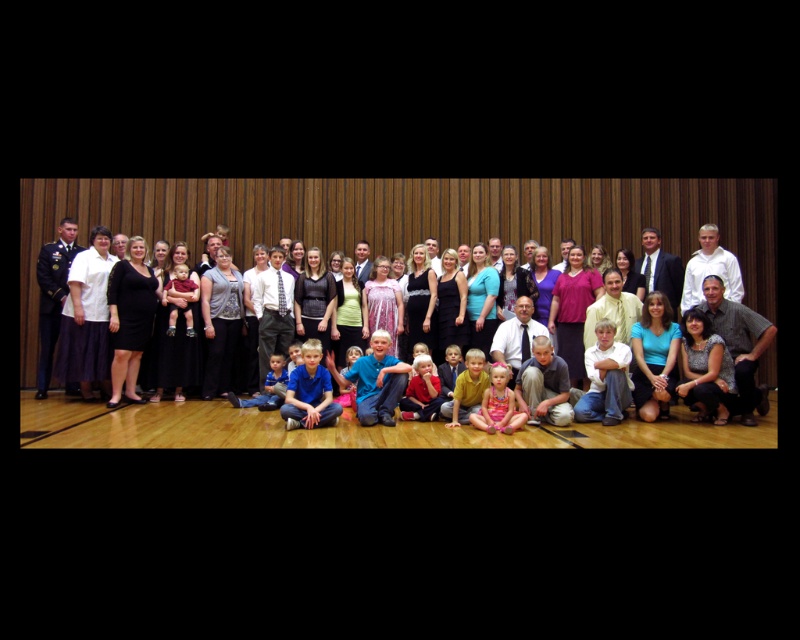
Between dark blue uniform at left and white shirt at center, which one has less height?

white shirt at center is shorter.

Between dark blue uniform at left and white shirt at center, which one appears on the right side from the viewer's perspective?

Positioned to the right is white shirt at center.

What are the coordinates of `dark blue uniform at left` in the screenshot? It's located at (52, 296).

Can you confirm if matte black dress at center is positioned below white shirt at center?

Yes, matte black dress at center is below white shirt at center.

Does matte black dress at center have a greater width compared to white shirt at center?

Yes.

The width and height of the screenshot is (800, 640). Identify the location of matte black dress at center. (62, 420).

Is dark blue uniform at left thinner than matte black suit at center?

Incorrect, dark blue uniform at left's width is not less than matte black suit at center's.

Does dark blue uniform at left appear under matte black suit at center?

Yes.

Describe the element at coordinates (52, 296) in the screenshot. The width and height of the screenshot is (800, 640). I see `dark blue uniform at left` at that location.

Find the location of a particular element. Image resolution: width=800 pixels, height=640 pixels. dark blue uniform at left is located at coordinates click(52, 296).